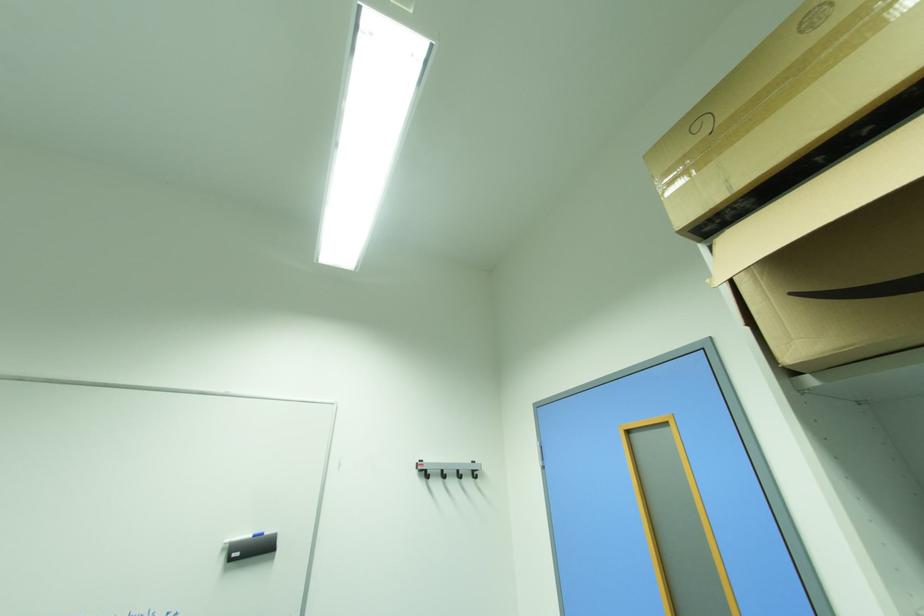
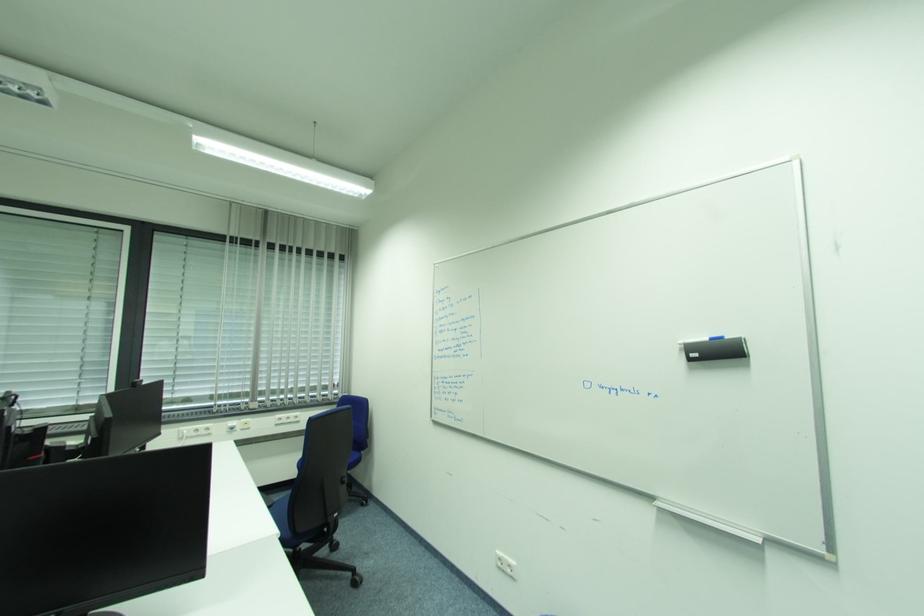
Question: The images are taken continuously from a first-person perspective. In which direction is your viewpoint rotating?

Choices:
 (A) Left
 (B) Right
 (C) Up
 (D) Down

Answer: (A)